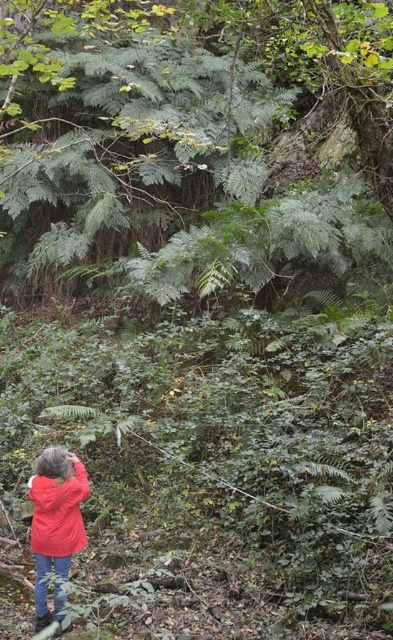
You are a hiker trying to take a photo of the green leafy tree at upper center. You are wearing the red matte jacket at lower left. Can you stand up straight to get a better view of the tree without bending over?

The green leafy tree at upper center is taller than the red matte jacket at lower left, so yes, you can stand up straight to get a better view of the tree without bending over since the tree is taller than your jacket.

You are a hiker trying to take a photo of the green leafy tree at upper center without the red matte jacket at lower left blocking the view. Can you move to the right to get a clear shot?

The green leafy tree at upper center might be wider than the red matte jacket at lower left, so moving to the right might not be sufficient to avoid the jacket blocking the view. Consider adjusting your position further or changing your angle.